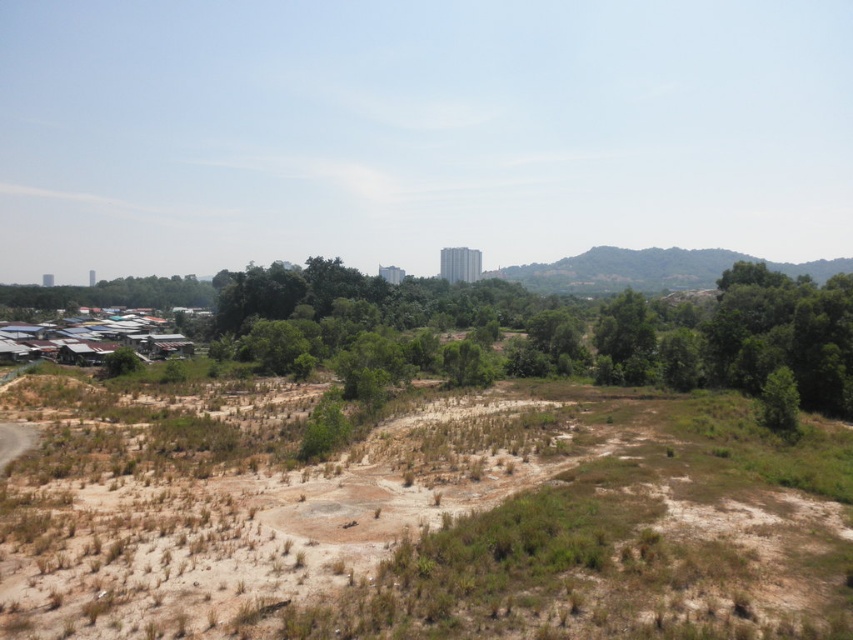
Question: Which point is closer to the camera?

Choices:
 (A) green grassy hillside at upper right
 (B) brown dry grass at center
 (C) green leafy tree at center

Answer: (B)

Question: Which object is closer to the camera taking this photo?

Choices:
 (A) green leafy tree at center
 (B) green grassy hillside at upper right
 (C) brown dry grass at center

Answer: (C)

Question: Is green leafy tree at center positioned behind green grassy hillside at upper right?

Choices:
 (A) no
 (B) yes

Answer: (A)

Question: Can you confirm if green leafy tree at center is bigger than green grassy hillside at upper right?

Choices:
 (A) no
 (B) yes

Answer: (B)

Question: Is brown dry grass at center above green grassy hillside at upper right?

Choices:
 (A) yes
 (B) no

Answer: (B)

Question: Which of the following is the farthest from the observer?

Choices:
 (A) brown dry grass at center
 (B) green grassy hillside at upper right

Answer: (B)